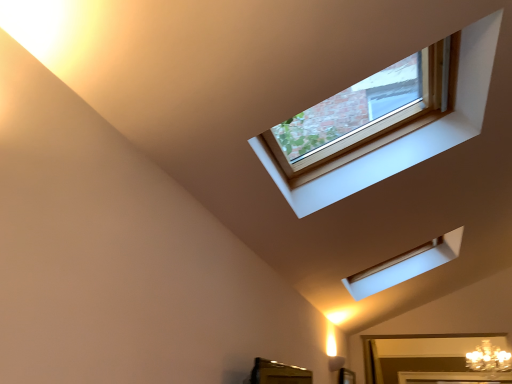
Measure the distance between point (464, 86) and camera.

A distance of 6.29 feet exists between point (464, 86) and camera.

The image size is (512, 384). Describe the element at coordinates (409, 134) in the screenshot. I see `wooden frame window at upper center` at that location.

Find the location of a particular element. The width and height of the screenshot is (512, 384). wooden frame window at upper center is located at coordinates (409, 134).

You are a GUI agent. You are given a task and a screenshot of the screen. Output one action in this format:
    pyautogui.click(x=<x>, y=<y>)
    Task: Click on the wooden frame window at upper center
    
    Given the screenshot: What is the action you would take?
    pyautogui.click(x=409, y=134)